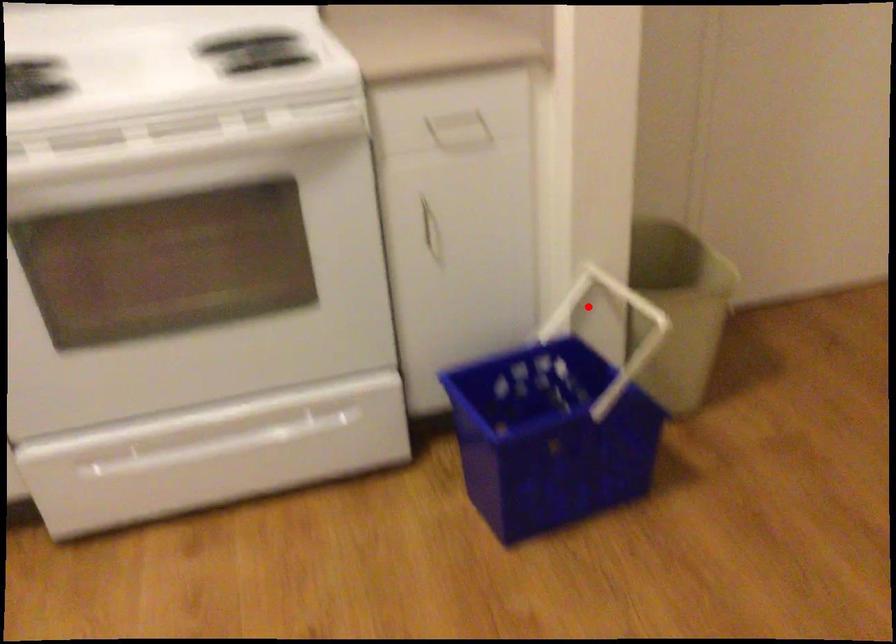
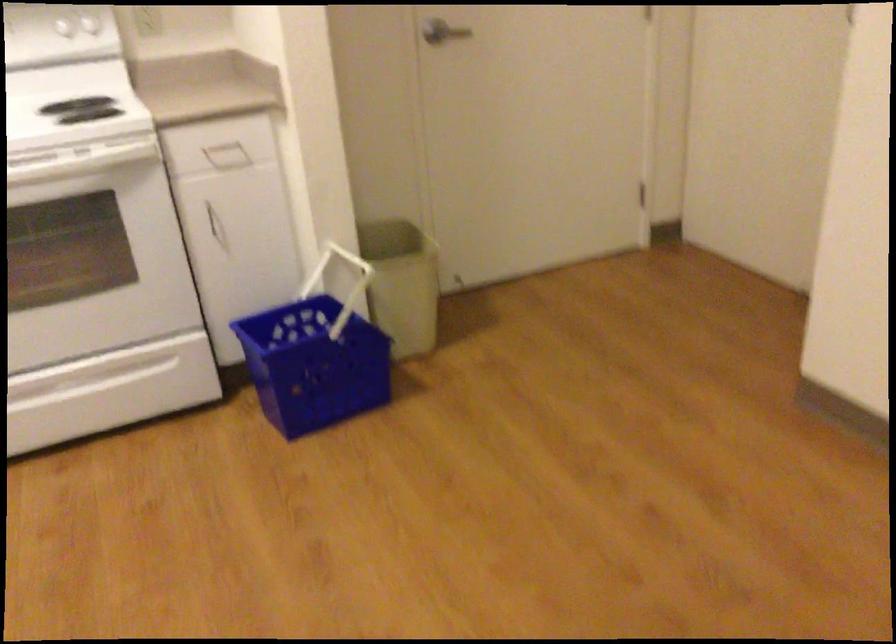
The point at the highlighted location is marked in the first image. Where is the corresponding point in the second image?

(337, 272)